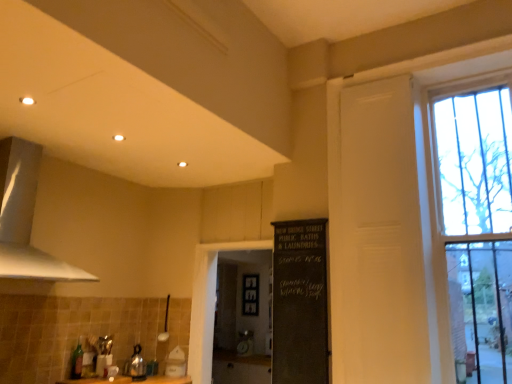
Question: Does black chalkboard at center, which is the 1th screen door in back-to-front order, have a larger size compared to white painted wood window at upper right?

Choices:
 (A) no
 (B) yes

Answer: (B)

Question: Is black chalkboard at center, which is the 1th screen door in back-to-front order, oriented away from white painted wood window at upper right?

Choices:
 (A) yes
 (B) no

Answer: (B)

Question: From the image's perspective, is black chalkboard at center, which is counted as the second screen door, starting from the front, on top of white painted wood window at upper right?

Choices:
 (A) yes
 (B) no

Answer: (B)

Question: Considering the relative sizes of black chalkboard at center, which is counted as the second screen door, starting from the front, and white painted wood window at upper right in the image provided, is black chalkboard at center, which is counted as the second screen door, starting from the front, wider than white painted wood window at upper right?

Choices:
 (A) no
 (B) yes

Answer: (B)

Question: Can you confirm if black chalkboard at center, which is counted as the second screen door, starting from the front, is taller than white painted wood window at upper right?

Choices:
 (A) yes
 (B) no

Answer: (B)

Question: Is black chalkboard at center, the 1th screen door viewed from the left, shorter than white painted wood window at upper right?

Choices:
 (A) no
 (B) yes

Answer: (B)

Question: Would you consider white matte exhaust hood at upper left to be distant from black chalkboard at center?

Choices:
 (A) yes
 (B) no

Answer: (A)

Question: From the image's perspective, would you say white matte exhaust hood at upper left is shown under black chalkboard at center?

Choices:
 (A) no
 (B) yes

Answer: (A)

Question: Does white matte exhaust hood at upper left have a greater width compared to black chalkboard at center?

Choices:
 (A) yes
 (B) no

Answer: (A)

Question: Can you confirm if white matte exhaust hood at upper left is positioned to the right of black chalkboard at center?

Choices:
 (A) no
 (B) yes

Answer: (A)

Question: Does white matte exhaust hood at upper left have a smaller size compared to black chalkboard at center?

Choices:
 (A) yes
 (B) no

Answer: (B)

Question: Is white matte exhaust hood at upper left looking in the opposite direction of black chalkboard at center?

Choices:
 (A) no
 (B) yes

Answer: (A)

Question: Does green glass bottle at lower left have a lesser width compared to black chalkboard at center?

Choices:
 (A) yes
 (B) no

Answer: (A)